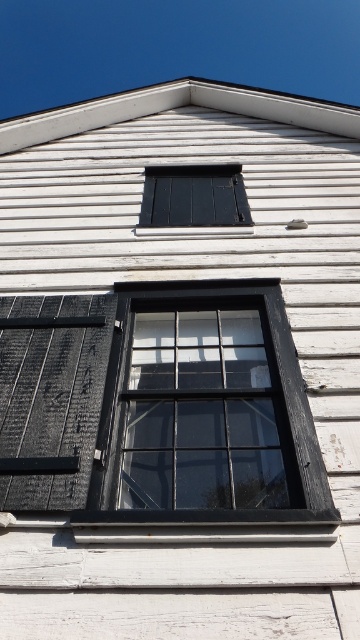
How distant is black wood shutter at left from matte black window at center?

6.80 feet

Which is behind, point (81, 440) or point (222, 200)?

The point (222, 200) is behind.

Locate an element on the screen. The image size is (360, 640). black wood shutter at left is located at coordinates (51, 396).